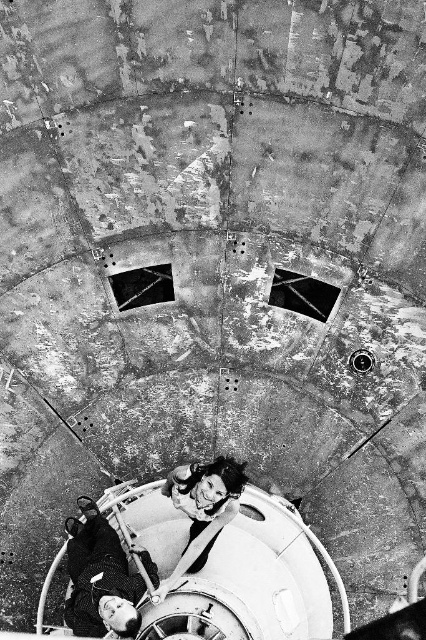
Does smooth leather jacket at lower left have a larger size compared to smooth skin woman at center?

Yes.

Describe the element at coordinates (100, 577) in the screenshot. The width and height of the screenshot is (426, 640). I see `smooth leather jacket at lower left` at that location.

The width and height of the screenshot is (426, 640). I want to click on smooth leather jacket at lower left, so click(100, 577).